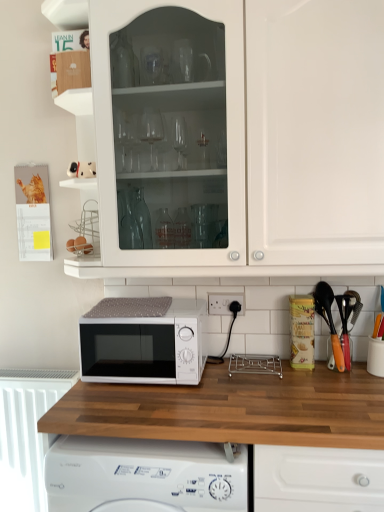
Where is `wooden at center`? wooden at center is located at coordinates (231, 410).

Describe the element at coordinates (231, 410) in the screenshot. I see `wooden at center` at that location.

Where is `white glossy cabinet at upper center`? Image resolution: width=384 pixels, height=512 pixels. white glossy cabinet at upper center is located at coordinates (315, 137).

Is white glossy cabinet at upper center wider than white matte microwave at center?

Yes, white glossy cabinet at upper center is wider than white matte microwave at center.

From a real-world perspective, is white glossy cabinet at upper center above or below white matte microwave at center?

From a real-world perspective, white glossy cabinet at upper center is physically above white matte microwave at center.

Locate an element on the screen. The height and width of the screenshot is (512, 384). cabinetry above the white matte microwave at center (from the image's perspective) is located at coordinates (315, 137).

Is white glossy cabinet at upper center to the left of white matte microwave at center from the viewer's perspective?

No.

Which of these two, wooden at center or white matte microwave at center, is bigger?

wooden at center.

Measure the distance between wooden at center and white matte microwave at center.

They are 8.85 inches apart.

Between wooden at center and white matte microwave at center, which one has smaller width?

white matte microwave at center.

Considering the positions of objects wooden at center and white matte microwave at center in the image provided, who is more to the left, wooden at center or white matte microwave at center?

From the viewer's perspective, white matte microwave at center appears more on the left side.

Is white matte microwave at center facing towards white plastic electric outlet at lower center?

No.

Looking at their sizes, would you say white matte microwave at center is wider or thinner than white plastic electric outlet at lower center?

Considering their sizes, white matte microwave at center looks broader than white plastic electric outlet at lower center.

Based on the photo, from the image's perspective, who appears lower, wooden at center or white plastic electric outlet at lower center?

wooden at center appears lower in the image.

Is wooden at center facing away from white plastic electric outlet at lower center?

No, white plastic electric outlet at lower center is not at the back of wooden at center.

Is wooden at center taller than white plastic electric outlet at lower center?

Correct, wooden at center is much taller as white plastic electric outlet at lower center.

Is wooden at center far from white plastic electric outlet at lower center?

That's not correct — wooden at center is a little close to white plastic electric outlet at lower center.

Between white plastic electric outlet at lower center and white matte microwave at center, which one has more height?

Standing taller between the two is white matte microwave at center.

Does white plastic electric outlet at lower center appear on the left side of white matte microwave at center?

In fact, white plastic electric outlet at lower center is to the right of white matte microwave at center.

Which object is thinner, white plastic electric outlet at lower center or white matte microwave at center?

With smaller width is white plastic electric outlet at lower center.

Is white plastic electric outlet at lower center aimed at white matte microwave at center?

No, white plastic electric outlet at lower center does not turn towards white matte microwave at center.

Between white matte microwave at center and white glossy cabinet at upper center, which one has smaller size?

With smaller size is white matte microwave at center.

Looking at this image, from a real-world perspective, is white matte microwave at center beneath white glossy cabinet at upper center?

Yes, from a real-world perspective, white matte microwave at center is under white glossy cabinet at upper center.

Locate an element on the screen. This screenshot has width=384, height=512. microwave oven lying on the left of white glossy cabinet at upper center is located at coordinates (143, 341).

Considering the sizes of objects white matte microwave at center and white glossy cabinet at upper center in the image provided, who is shorter, white matte microwave at center or white glossy cabinet at upper center?

white matte microwave at center.

This screenshot has width=384, height=512. I want to click on microwave oven on the left of wooden at center, so click(143, 341).

From a real-world perspective, is white matte microwave at center positioned above or below wooden at center?

white matte microwave at center is situated higher than wooden at center in the real world.

Between point (99, 379) and point (226, 361), which one is positioned in front?

The point (99, 379) is closer to the camera.

Is white matte microwave at center bigger or smaller than wooden at center?

Clearly, white matte microwave at center is smaller in size than wooden at center.

At what (x,y) coordinates should I click in order to perform the action: click on microwave oven below the white glossy cabinet at upper center (from a real-world perspective). Please return your answer as a coordinate pair (x, y). This screenshot has height=512, width=384. Looking at the image, I should click on (143, 341).

This screenshot has width=384, height=512. Identify the location of microwave oven that is on the left side of wooden at center. (143, 341).

Looking at the image, which one is located closer to white matte microwave at center, white plastic radiator at lower left or wooden at center?

Based on the image, wooden at center appears to be nearer to white matte microwave at center.

Estimate the real-world distances between objects in this image. Which object is closer to white plastic electric outlet at lower center, white plastic radiator at lower left or wooden at center?

wooden at center.

Which object lies further to the anchor point wooden at center, white plastic electric outlet at lower center or white plastic radiator at lower left?

white plastic radiator at lower left is further to wooden at center.

From the image, which object appears to be farther from white glossy cabinet at upper center, white matte microwave at center or white plastic radiator at lower left?

white plastic radiator at lower left lies further to white glossy cabinet at upper center than the other object.

Based on their spatial positions, is white plastic radiator at lower left or white glossy cabinet at upper center closer to wooden at center?

white glossy cabinet at upper center is closer to wooden at center.

Based on their spatial positions, is white glossy cabinet at upper center or white plastic radiator at lower left closer to white matte microwave at center?

The object closer to white matte microwave at center is white glossy cabinet at upper center.

Estimate the real-world distances between objects in this image. Which object is closer to white glossy cabinet at upper center, wooden at center or white matte microwave at center?

white matte microwave at center is positioned closer to the anchor white glossy cabinet at upper center.

Estimate the real-world distances between objects in this image. Which object is closer to white glossy cabinet at upper center, white plastic electric outlet at lower center or white matte microwave at center?

Among the two, white matte microwave at center is located nearer to white glossy cabinet at upper center.

This screenshot has width=384, height=512. I want to click on countertop between white plastic radiator at lower left and white plastic electric outlet at lower center in the horizontal direction, so click(x=231, y=410).

Find the location of a particular element. The height and width of the screenshot is (512, 384). electric outlet between white glossy cabinet at upper center and white plastic radiator at lower left from top to bottom is located at coordinates (224, 303).

At what (x,y) coordinates should I click in order to perform the action: click on microwave oven between white plastic electric outlet at lower center and wooden at center in the up-down direction. Please return your answer as a coordinate pair (x, y). Looking at the image, I should click on (143, 341).

You are a GUI agent. You are given a task and a screenshot of the screen. Output one action in this format:
    pyautogui.click(x=<x>, y=<y>)
    Task: Click on the microwave oven between white glossy cabinet at upper center and white plastic radiator at lower left in the up-down direction
    
    Given the screenshot: What is the action you would take?
    pyautogui.click(x=143, y=341)